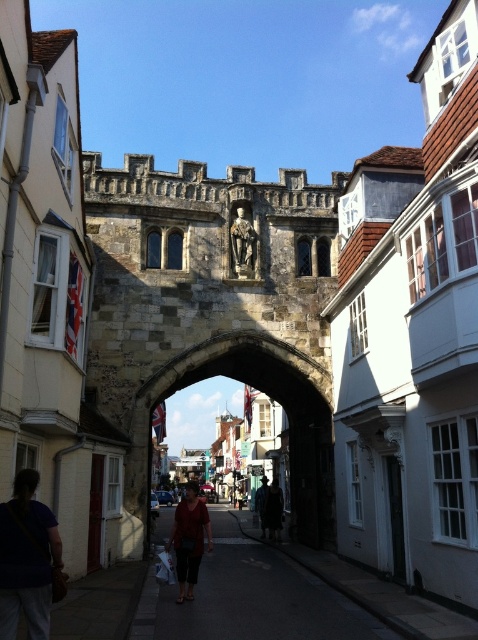
You are standing in front of the historic stone archway and notice a small point marked at coordinates (26, 560). Based on the scene description, can you identify what object or feature this point corresponds to?

The point at coordinates (26, 560) corresponds to the dark blue shirt at lower left.

You are a photographer standing in front of the historic stone archway. You notice the dark gray asphalt at center and the matte red dress at center in the scene. Which object is lower in height compared to the other?

The dark gray asphalt at center is shorter than the matte red dress at center, so the dark gray asphalt at center is lower in height.

You are standing in front of the historic stone archway and notice two items on the ground. The dark blue shirt at lower left and the dark brown leather jacket at center. Which item is closer to your left side?

The dark blue shirt at lower left is closer to your left side as it is positioned to the left of the dark brown leather jacket at center.